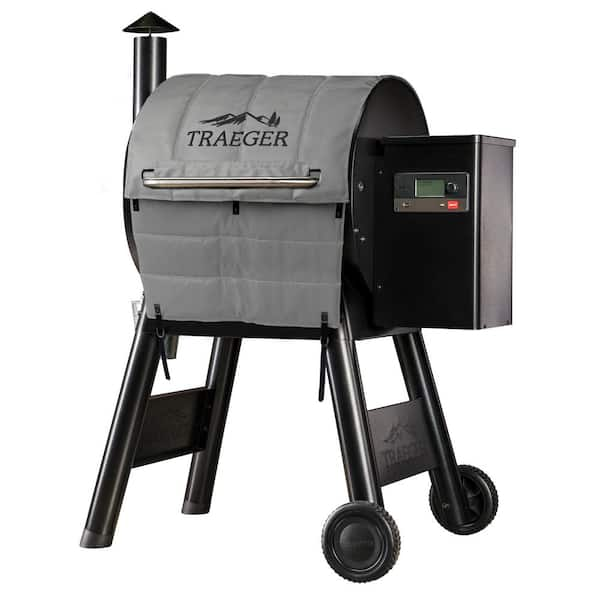
Identify the location of bottom grey padding. point(245,273).